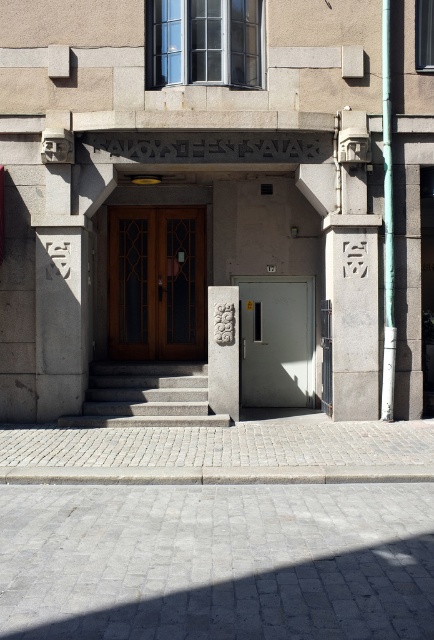
You are a delivery person approaching the entrance of the building. You need to place a heavy box on the gray cobblestone pavement at lower center and the carved stone column at center. Which surface is more to the left where you can place the box?

The gray cobblestone pavement at lower center is positioned on the left side of the carved stone column at center, so it is more to the left and suitable for placing the box there.

You are a delivery person carrying a heavy package and need to reach the entrance of the building. You see the gray cobblestone pavement at lower center and the gray concrete stairs at center. Which path should you take to reach the entrance without climbing stairs?

The gray cobblestone pavement at lower center is below the gray concrete stairs at center, so you should take the gray cobblestone pavement at lower center to reach the entrance without climbing stairs.